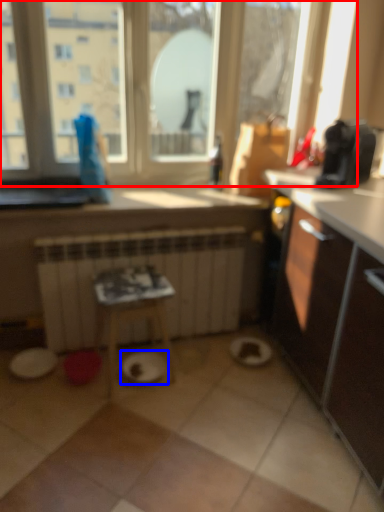
Question: Which object appears closest to the camera in this image, window (highlighted by a red box) or paper plate (highlighted by a blue box)?

Choices:
 (A) window
 (B) paper plate

Answer: (A)